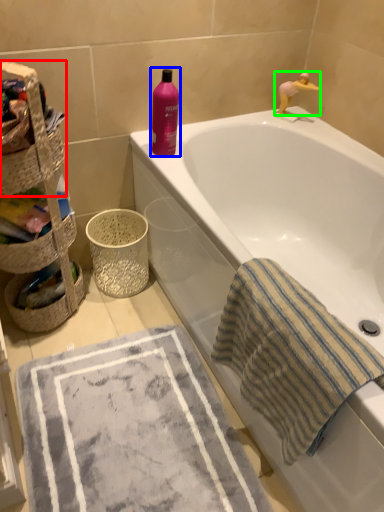
Question: Based on their relative distances, which object is nearer to basket container (highlighted by a red box)? Choose from cleaning product (highlighted by a blue box) and toy (highlighted by a green box).

Choices:
 (A) cleaning product
 (B) toy

Answer: (A)